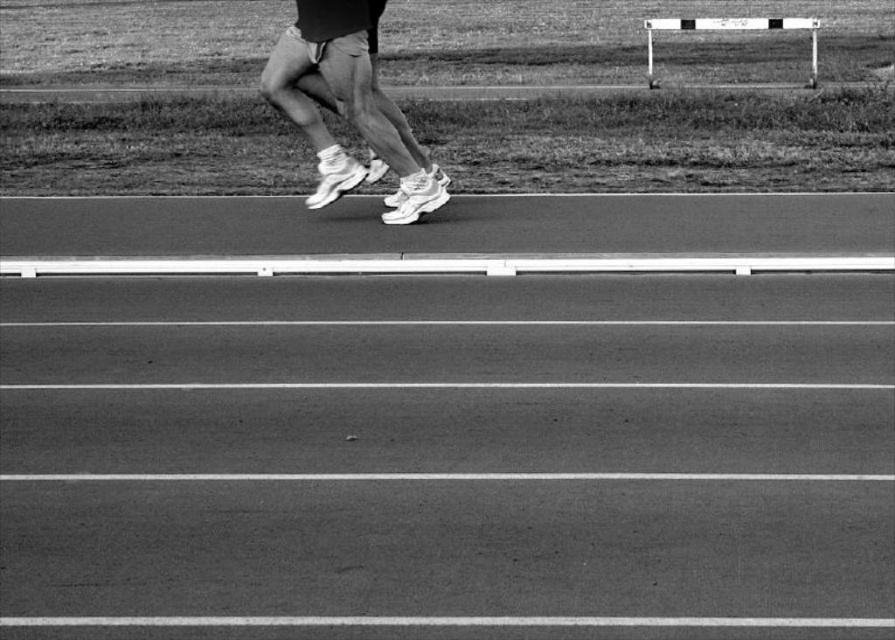
Question: Which object is the farthest from the white mesh sneakers at center?

Choices:
 (A) smooth asphalt track at center
 (B) metallic silver hurdle at upper right

Answer: (B)

Question: Does white mesh sneakers at center appear on the right side of metallic silver hurdle at upper right?

Choices:
 (A) no
 (B) yes

Answer: (A)

Question: Can you confirm if smooth asphalt track at center is positioned to the right of white mesh sneakers at center?

Choices:
 (A) yes
 (B) no

Answer: (A)

Question: Is the position of smooth asphalt track at center less distant than that of white mesh sneakers at center?

Choices:
 (A) no
 (B) yes

Answer: (B)

Question: Which object is positioned closest to the smooth asphalt track at center?

Choices:
 (A) white mesh sneakers at center
 (B) metallic silver hurdle at upper right

Answer: (A)

Question: Estimate the real-world distances between objects in this image. Which object is closer to the smooth asphalt track at center?

Choices:
 (A) metallic silver hurdle at upper right
 (B) white mesh sneakers at center

Answer: (B)